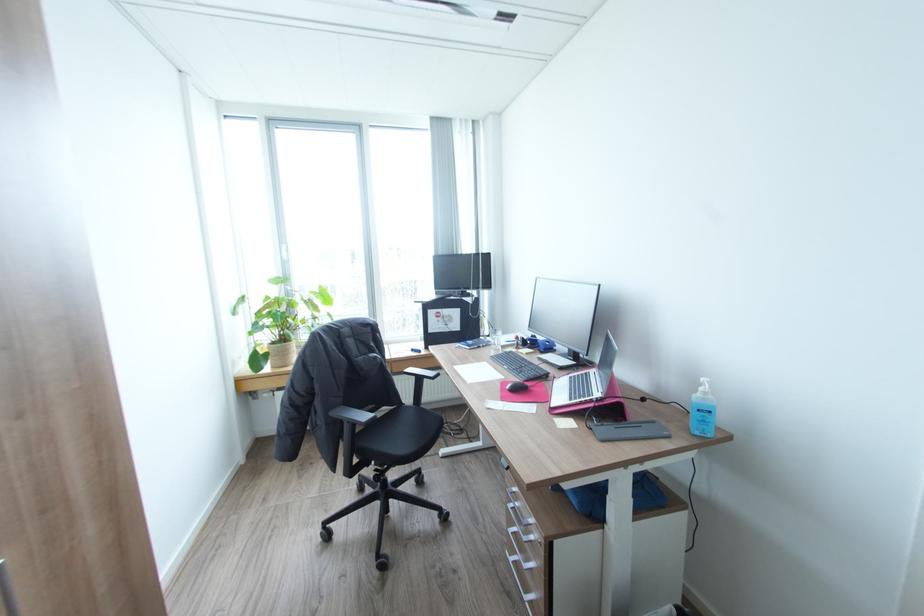
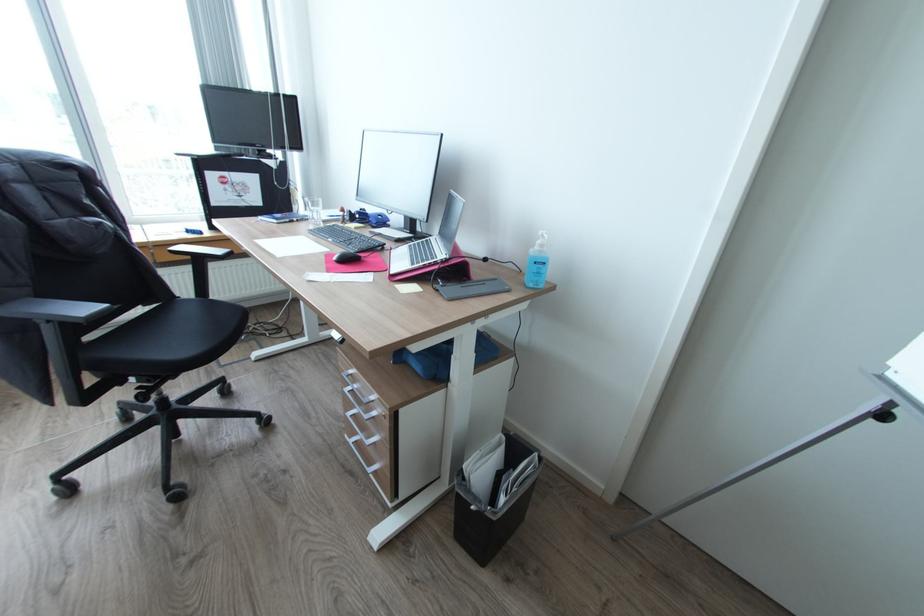
In the second image, find the point that corresponds to (507,399) in the first image.

(334, 270)